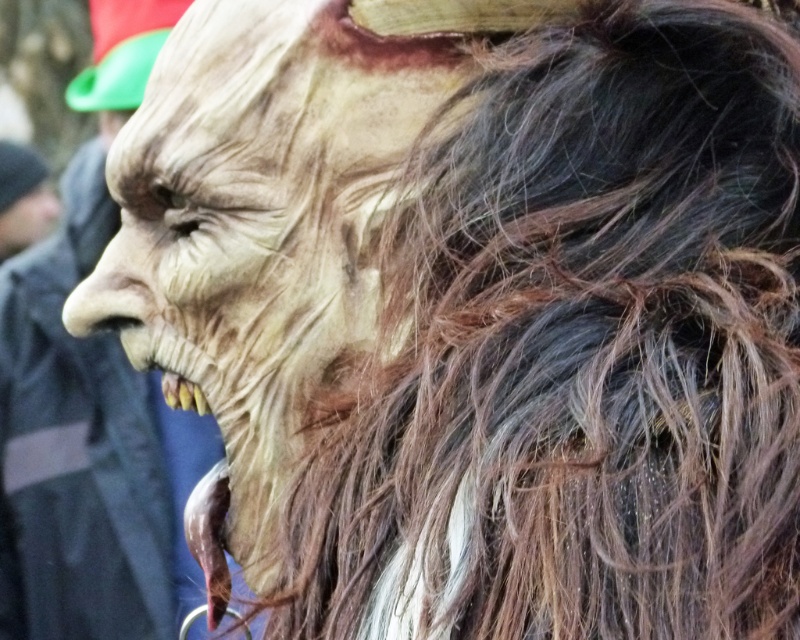
You are a photographer trying to capture the matte plastic mask at center in the image. The camera you are using has a focus point at coordinate point (258, 225). Will this focus point help you capture the matte plastic mask at center clearly?

The matte plastic mask at center is represented by point (258, 225), so yes, the focus point at coordinate point (258, 225) will help capture the matte plastic mask at center clearly.

You are an artist trying to sketch the scene. You notice the matte plastic mask at left and the matte black face at left. Which object is taller in the image?

The matte plastic mask at left has a greater height compared to the matte black face at left, so the matte plastic mask at left is taller.